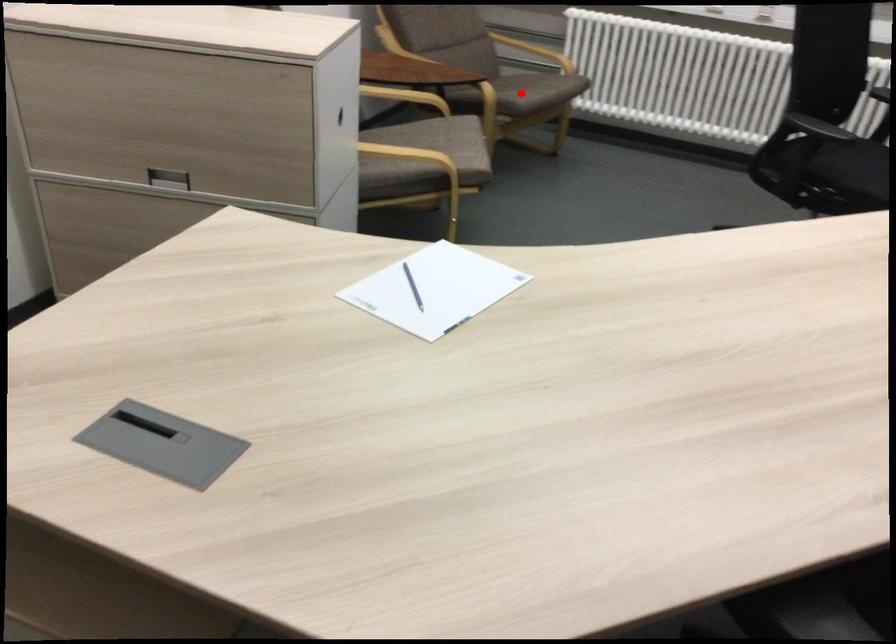
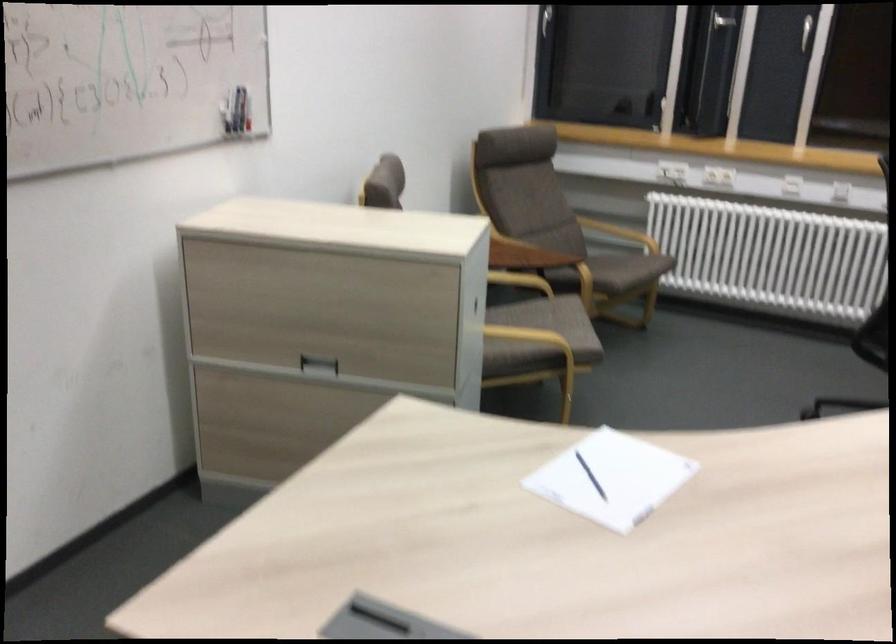
In the second image, find the point that corresponds to the highlighted location in the first image.

(618, 270)